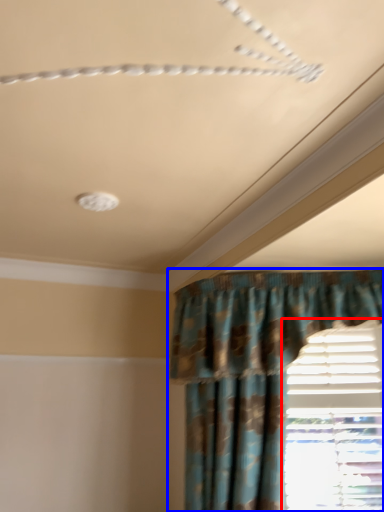
Question: Which object appears farthest to the camera in this image, window (highlighted by a red box) or curtain (highlighted by a blue box)?

Choices:
 (A) window
 (B) curtain

Answer: (A)